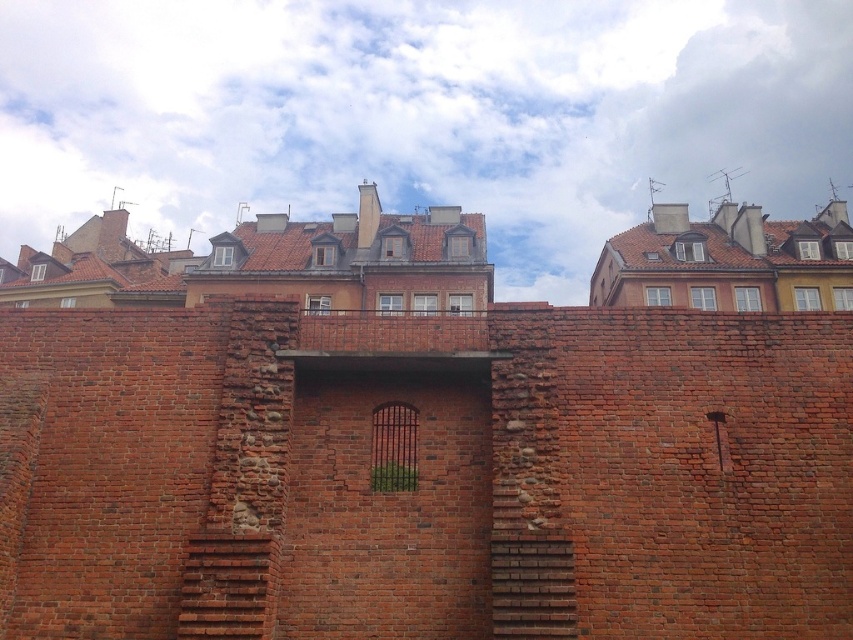
You are a tourist standing in front of the historic brick wall with two sets of stairs. You want to climb up to the smooth brick stairs at center. Which set of stairs should you take first?

You should take the brick stairs at center first because it is located below the smooth brick stairs at center, so you need to climb the lower one first to reach the upper one.

Looking at this image, you are standing at the base of the historic brick wall and want to reach the archway at the center. Which direction should you move relative to the brick stairs at center?

The brick stairs at center is located at point [229,586], so you should move towards the brick stairs at center to reach the archway at the center.